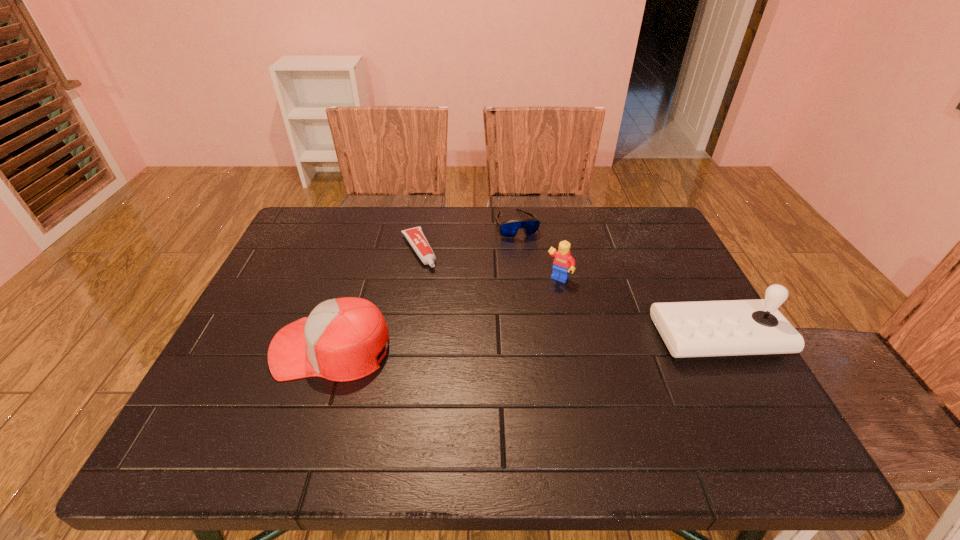
Image resolution: width=960 pixels, height=540 pixels. I want to click on baseball cap, so click(x=340, y=340).

Locate an element on the screen. joystick is located at coordinates (732, 329).

I want to click on the tallest object, so click(x=732, y=329).

Identify the location of the third nearest object. 563,262.

The image size is (960, 540). In order to click on sunglasses in this screenshot , I will do [508, 229].

This screenshot has height=540, width=960. I want to click on toothpaste, so click(415, 236).

This screenshot has width=960, height=540. I want to click on vacant space located on the front-facing side of the baseball cap, so click(234, 348).

You are a GUI agent. You are given a task and a screenshot of the screen. Output one action in this format:
    pyautogui.click(x=<x>, y=<y>)
    Task: Click on the vacant space located on the front-facing side of the baseball cap
    
    Given the screenshot: What is the action you would take?
    pyautogui.click(x=238, y=348)

The image size is (960, 540). I want to click on blank space located 0.090m on the back of the joystick, so click(690, 287).

At what (x,y) coordinates should I click in order to perform the action: click on vacant space located 0.160m on the face of the third farthest object. Please return your answer as a coordinate pair (x, y). The height and width of the screenshot is (540, 960). Looking at the image, I should click on (525, 321).